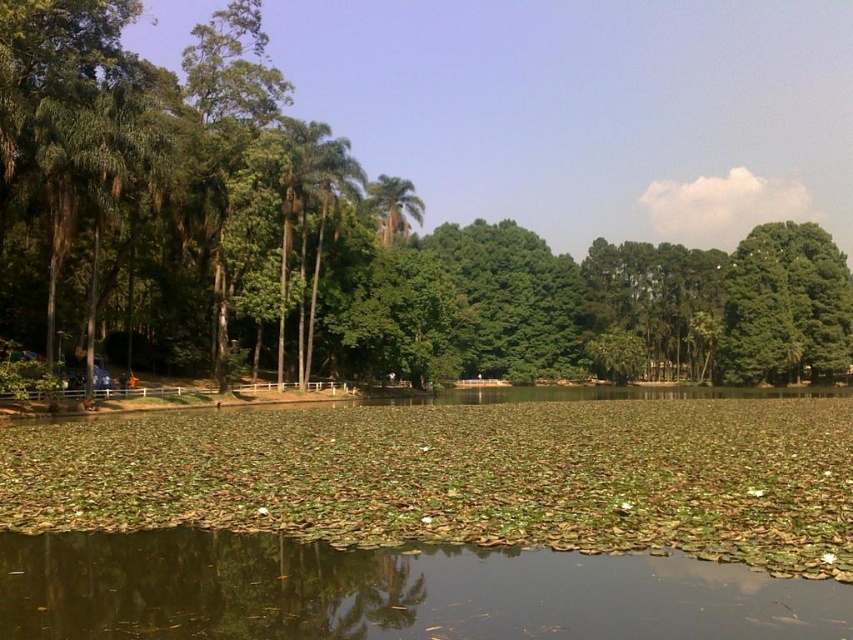
Does green leafy tree at left have a lesser height compared to green leafy palm tree at center?

Incorrect, green leafy tree at left's height does not fall short of green leafy palm tree at center's.

Which is in front, point (759, 192) or point (401, 188)?

Positioned in front is point (401, 188).

You are a GUI agent. You are given a task and a screenshot of the screen. Output one action in this format:
    pyautogui.click(x=<x>, y=<y>)
    Task: Click on the green leafy tree at left
    The image size is (853, 640).
    Given the screenshot: What is the action you would take?
    (334, 241)